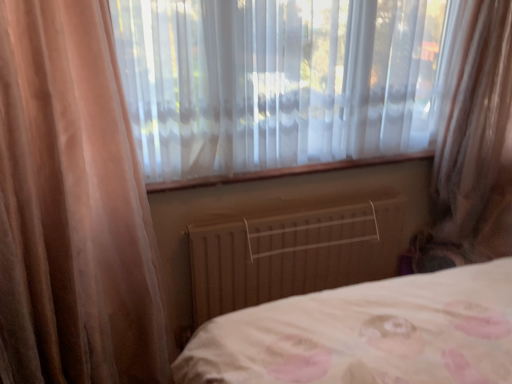
Question: From a real-world perspective, is translucent fabric curtain at right above or below translucent fabric at center?

Choices:
 (A) below
 (B) above

Answer: (A)

Question: Would you say translucent fabric curtain at right is inside or outside translucent fabric at center?

Choices:
 (A) inside
 (B) outside

Answer: (B)

Question: Estimate the real-world distances between objects in this image. Which object is farther from the translucent fabric curtain at right?

Choices:
 (A) wooden radiator at center
 (B) translucent fabric at center

Answer: (A)

Question: Which of these objects is positioned farthest from the wooden radiator at center?

Choices:
 (A) translucent fabric curtain at right
 (B) translucent fabric at center

Answer: (A)